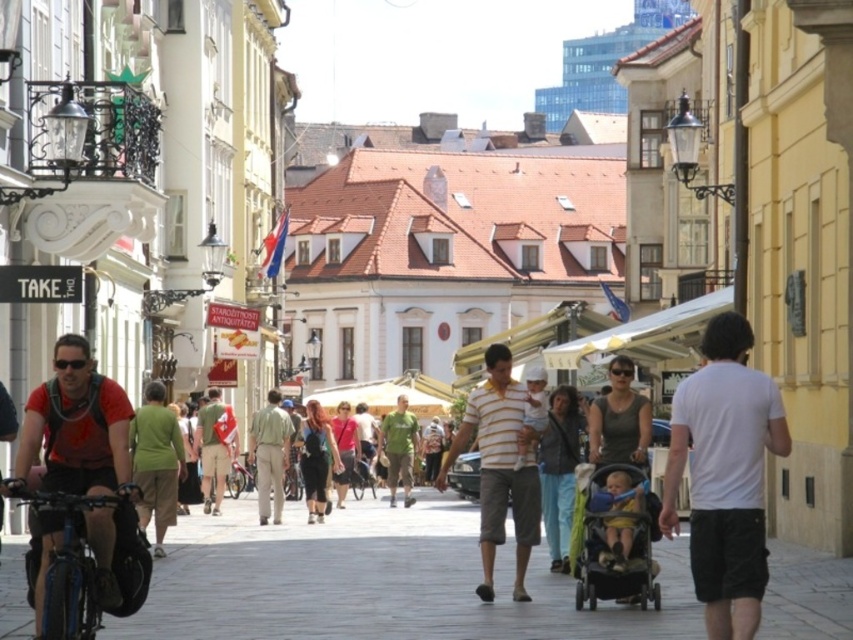
Consider the image. You are a delivery person carrying a package that is 1 meter wide. You are standing in the street and see the black plastic stroller at center and the green matte shirt at center. Can you pass through the space between them without tilting the package?

The black plastic stroller at center has a lesser width compared to green matte shirt at center. Since the package is 1 meter wide, and the space between the black plastic stroller at center and green matte shirt at center is wider than the stroller, you can pass through without tilting the package.

You are standing at the point with coordinates point (409,483) and want to walk towards the point with coordinates point (613,525). Which direction should you turn to face the direction of your destination?

You should turn to face the direction towards point (613,525), which is in front of point (409,483).